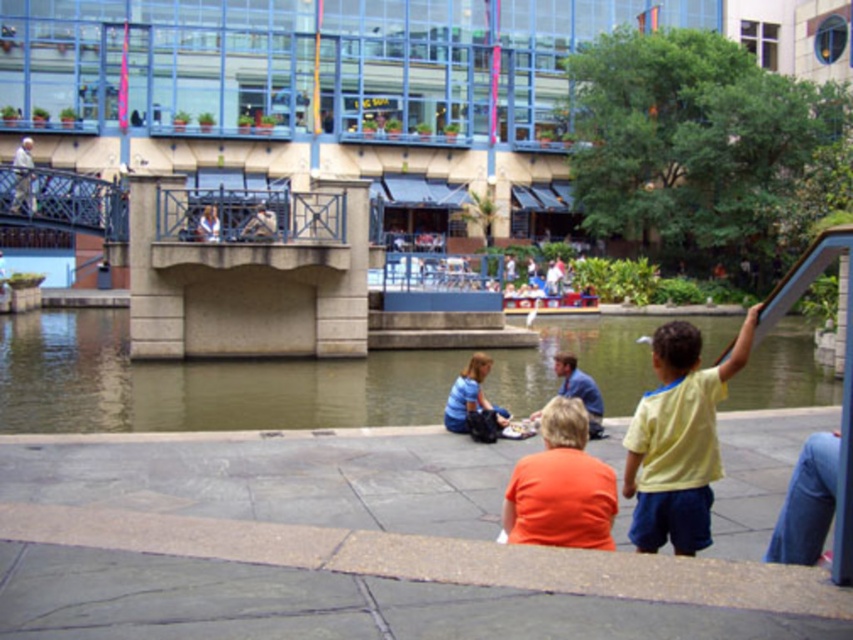
Consider the image. Does greenish water at center appear on the right side of light blue shirt at upper center?

Correct, you'll find greenish water at center to the right of light blue shirt at upper center.

Is the position of greenish water at center less distant than that of light blue shirt at upper center?

Yes, it is in front of light blue shirt at upper center.

Where is `greenish water at center`? The image size is (853, 640). greenish water at center is located at coordinates (198, 384).

Between greenish water at center and blue denim shirt at center, which one appears on the right side from the viewer's perspective?

Positioned to the right is blue denim shirt at center.

At what (x,y) coordinates should I click in order to perform the action: click on greenish water at center. Please return your answer as a coordinate pair (x, y). This screenshot has height=640, width=853. Looking at the image, I should click on (198, 384).

Is greenish water at center smaller than light gray concrete bridge at upper left?

Yes.

Can you confirm if greenish water at center is positioned to the left of light gray concrete bridge at upper left?

Incorrect, greenish water at center is not on the left side of light gray concrete bridge at upper left.

The image size is (853, 640). Identify the location of greenish water at center. (198, 384).